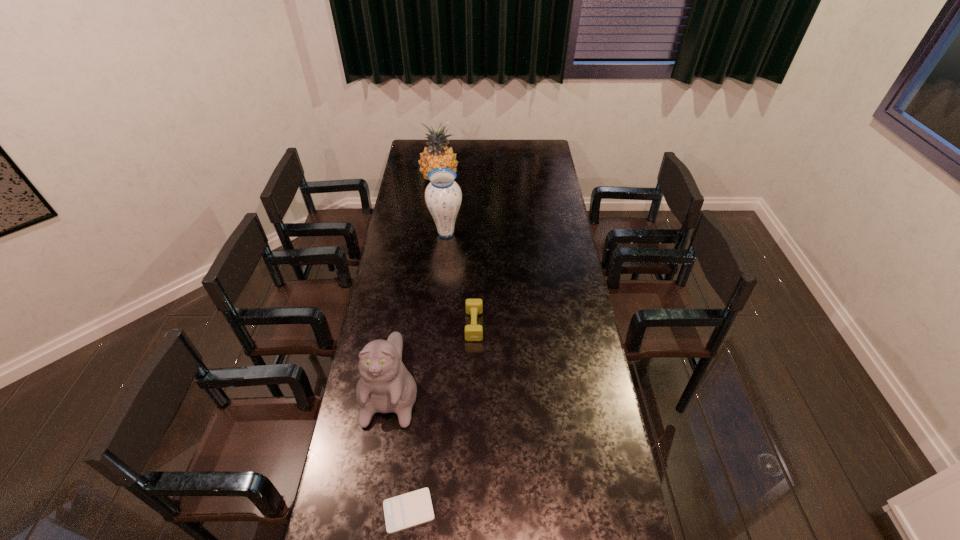
Locate an element on the screen. The image size is (960, 540). the closest object to the second shortest object is located at coordinates (385, 386).

The width and height of the screenshot is (960, 540). I want to click on vacant region that satisfies the following two spatial constraints: 1. on the face of the cat; 2. on the left side of the calculator, so click(x=372, y=510).

Locate an element on the screen. free spot that satisfies the following two spatial constraints: 1. on the back side of the calculator; 2. on the right side of the rightmost object is located at coordinates (428, 325).

The height and width of the screenshot is (540, 960). In order to click on blank space that satisfies the following two spatial constraints: 1. on the face of the cat; 2. on the right side of the nearest object in this screenshot , I will do `click(372, 510)`.